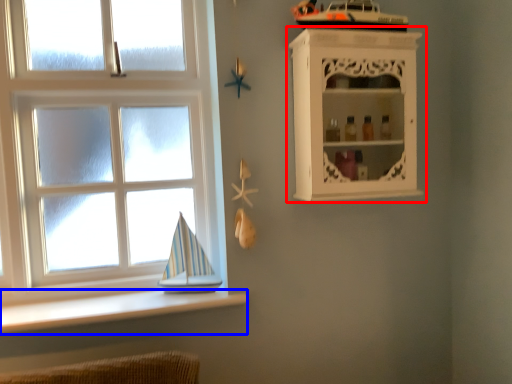
Question: Which of the following is the farthest to the observer, shelf (highlighted by a red box) or ledge (highlighted by a blue box)?

Choices:
 (A) shelf
 (B) ledge

Answer: (A)